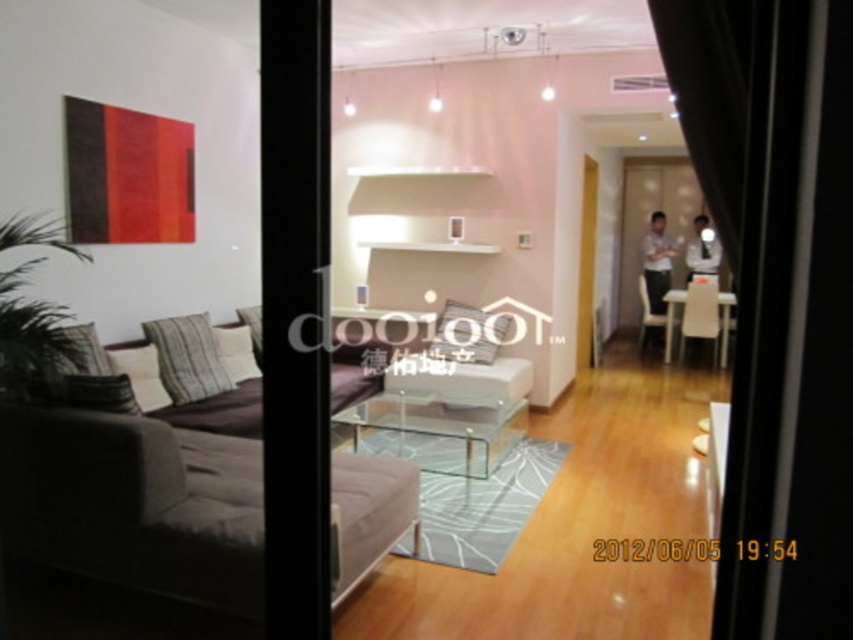
Question: Which object is farther from the camera taking this photo?

Choices:
 (A) transparent glass table at center
 (B) suede couch at left
 (C) black fabric curtain at right
 (D) transparent glass door at center

Answer: (A)

Question: Is suede couch at left to the right of transparent glass table at center from the viewer's perspective?

Choices:
 (A) yes
 (B) no

Answer: (B)

Question: Does black fabric curtain at right appear on the right side of transparent glass table at center?

Choices:
 (A) no
 (B) yes

Answer: (B)

Question: Does suede couch at left come behind black fabric curtain at right?

Choices:
 (A) no
 (B) yes

Answer: (B)

Question: Which point appears closest to the camera in this image?

Choices:
 (A) (798, 144)
 (B) (520, 417)
 (C) (320, 148)
 (D) (53, 445)

Answer: (A)

Question: Which point is closer to the camera?

Choices:
 (A) suede couch at left
 (B) transparent glass table at center
 (C) transparent glass door at center
 (D) black fabric curtain at right

Answer: (D)